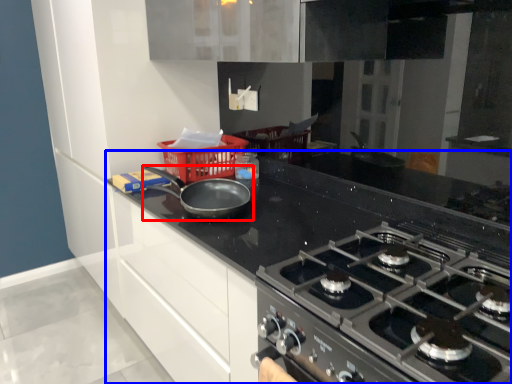
Question: Which of the following is the farthest to the observer, kitchen appliance (highlighted by a red box) or countertop (highlighted by a blue box)?

Choices:
 (A) kitchen appliance
 (B) countertop

Answer: (A)